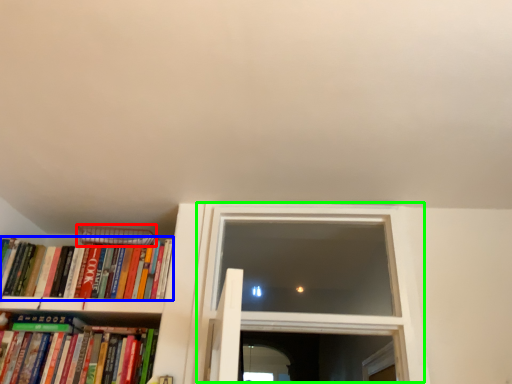
Question: Based on their relative distances, which object is nearer to paperback book (highlighted by a red box)? Choose from book (highlighted by a blue box) and window (highlighted by a green box).

Choices:
 (A) book
 (B) window

Answer: (A)